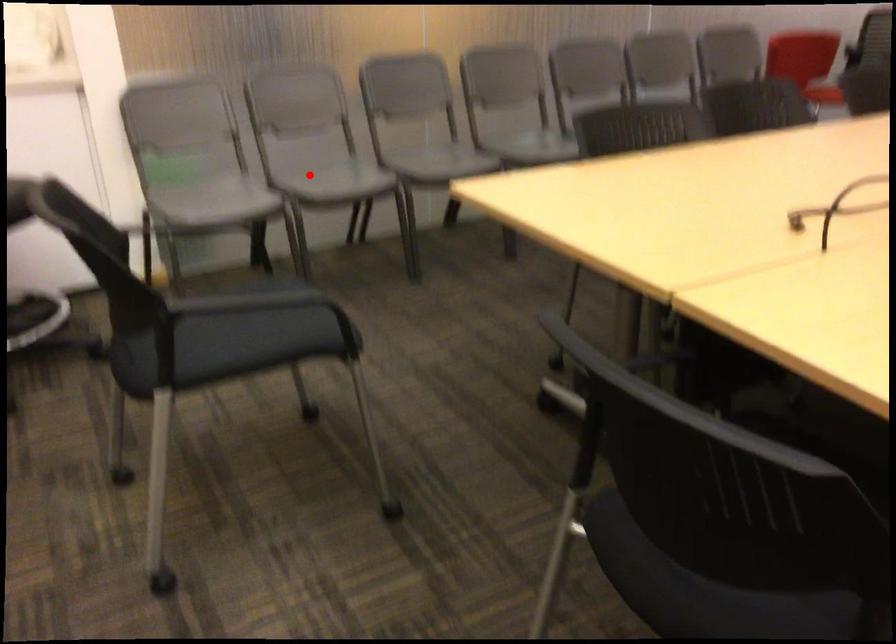
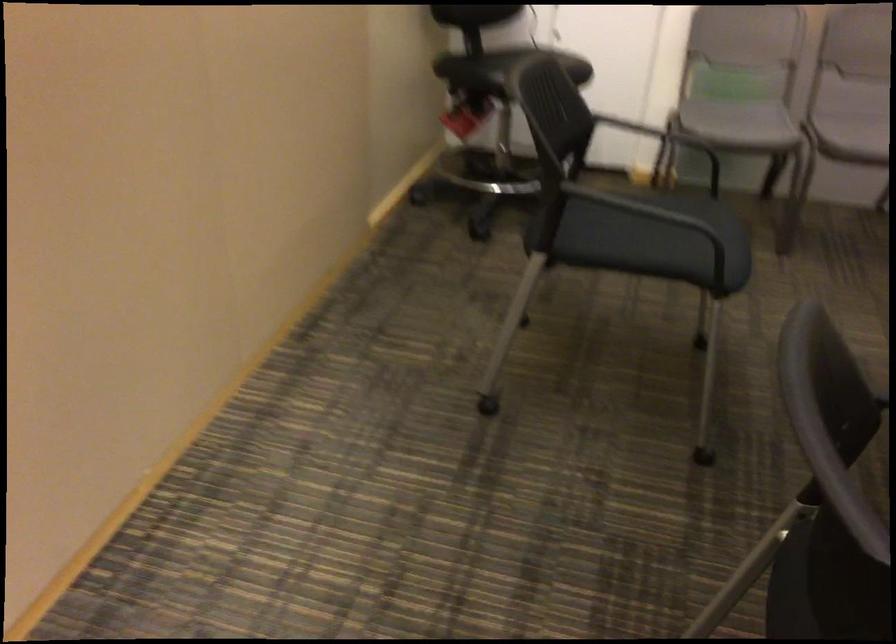
Question: I am providing you with two images of the same scene from different viewpoints. Given a red point in image1, look at the same physical point in image2. Is it:

Choices:
 (A) Closer to the viewpoint
 (B) Farther from the viewpoint

Answer: (A)